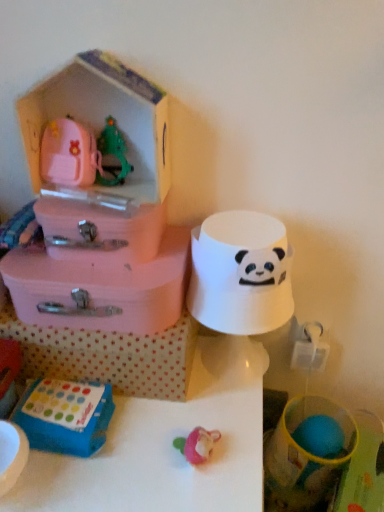
In order to click on empty space that is ontop of white felt hat at right, the 2th toy in the bottom-to-top sequence (from a real-world perspective) in this screenshot , I will do `click(245, 227)`.